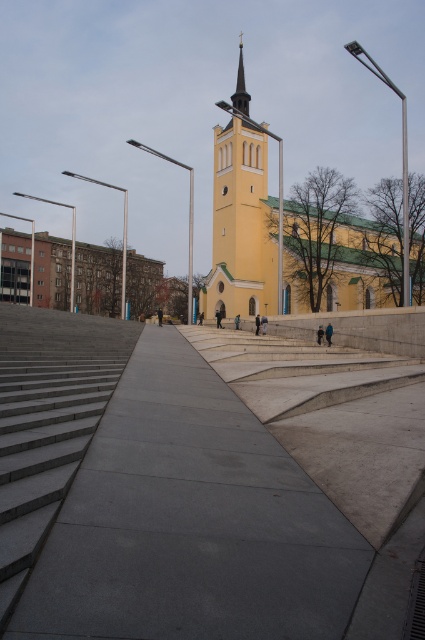
You are standing at the entrance of the yellow matte church at center. From your position, in which direction is the walkway leading up to the church?

The walkway leading up to the yellow matte church at center is in front of you since you are at the entrance facing the walkway.